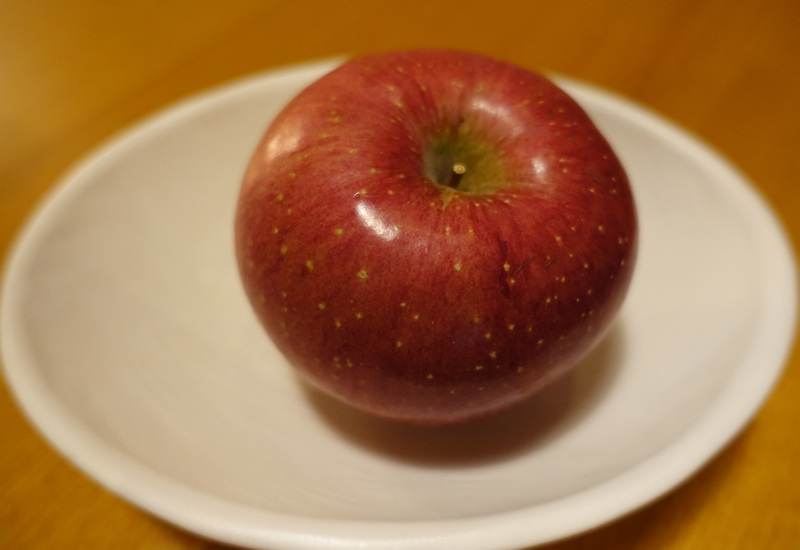
Where is `table`? This screenshot has height=550, width=800. table is located at coordinates (758, 530).